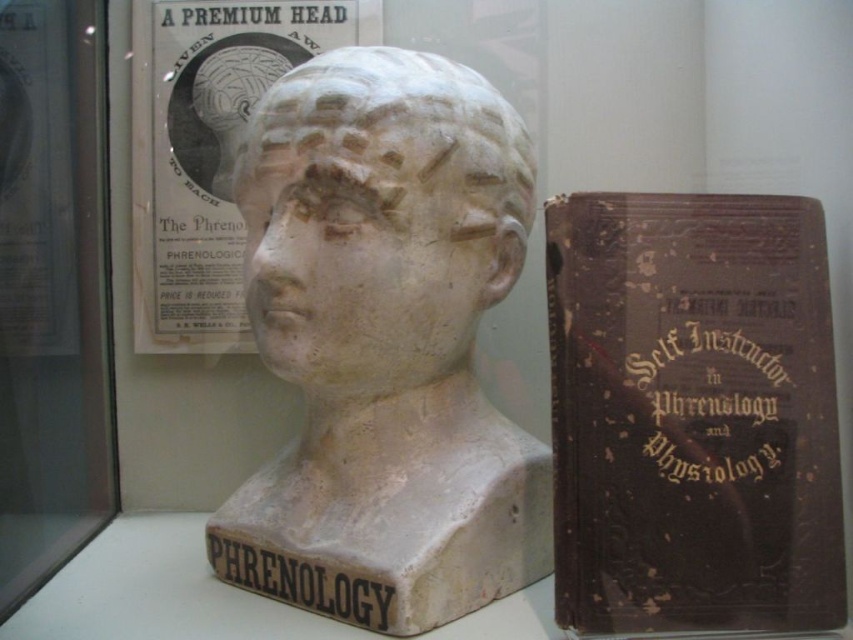
Who is more forward, (x=573, y=440) or (x=334, y=353)?

Positioned in front is point (x=573, y=440).

Is brown leather book at right positioned at the back of white plaster head at center?

That is False.

Which is behind, point (718, 356) or point (505, 109)?

The point (505, 109) is behind.

Where is `brown leather book at right`? The image size is (853, 640). brown leather book at right is located at coordinates (692, 413).